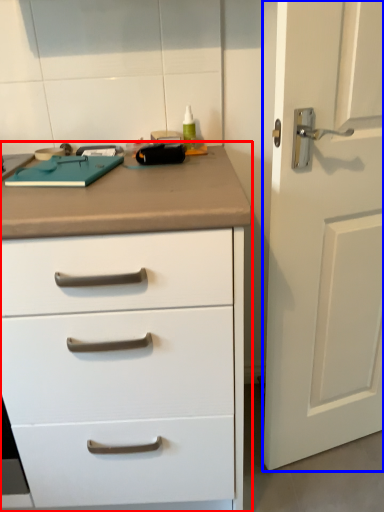
Question: Which object appears closest to the camera in this image, chest of drawers (highlighted by a red box) or door (highlighted by a blue box)?

Choices:
 (A) chest of drawers
 (B) door

Answer: (A)